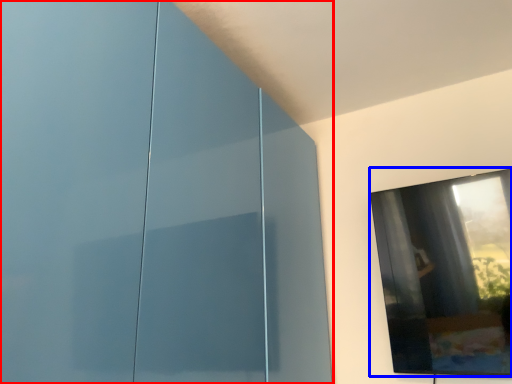
Question: Among these objects, which one is farthest to the camera, glass door (highlighted by a red box) or window (highlighted by a blue box)?

Choices:
 (A) glass door
 (B) window

Answer: (B)